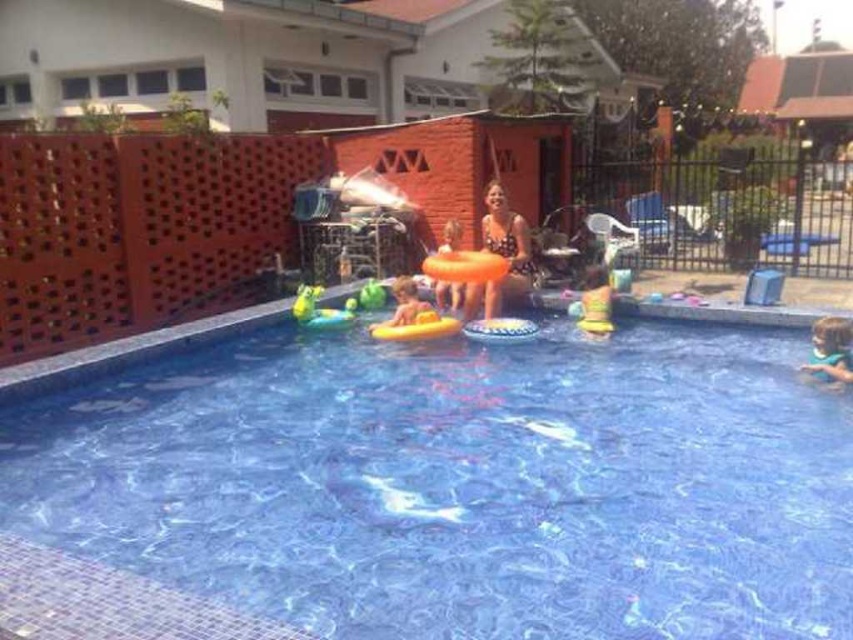
Question: Among these objects, which one is nearest to the camera?

Choices:
 (A) green matte shirt at lower right
 (B) blue glossy water at center
 (C) orange rubber ring at center

Answer: (B)

Question: Can you confirm if swimsuit fabric woman at center is wider than green rubber duck at center?

Choices:
 (A) yes
 (B) no

Answer: (A)

Question: Which of these objects is positioned closest to the blue glossy water at center?

Choices:
 (A) yellow rubber ring at center
 (B) green rubber duck at center

Answer: (B)

Question: Which of these objects is positioned farthest from the swimsuit fabric woman at center?

Choices:
 (A) orange rubber ring at center
 (B) green rubber duck at center

Answer: (B)

Question: Does blue glossy water at center appear on the left side of green matte shirt at lower right?

Choices:
 (A) no
 (B) yes

Answer: (B)

Question: Can you confirm if swimsuit fabric woman at center is bigger than yellow rubber ring at center?

Choices:
 (A) yes
 (B) no

Answer: (A)